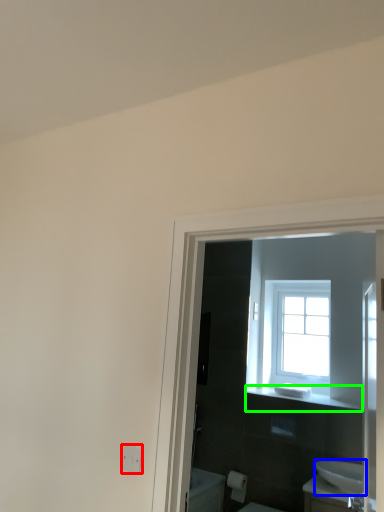
Question: Which is nearer to the electric outlet (highlighted by a red box)? sink (highlighted by a blue box) or balustrade (highlighted by a green box).

Choices:
 (A) sink
 (B) balustrade

Answer: (A)